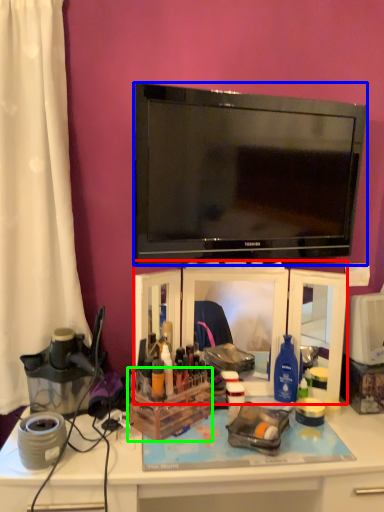
Question: Considering the real-world distances, which object is closest to tv cabinet (highlighted by a red box)? television (highlighted by a blue box) or storage box (highlighted by a green box).

Choices:
 (A) television
 (B) storage box

Answer: (B)